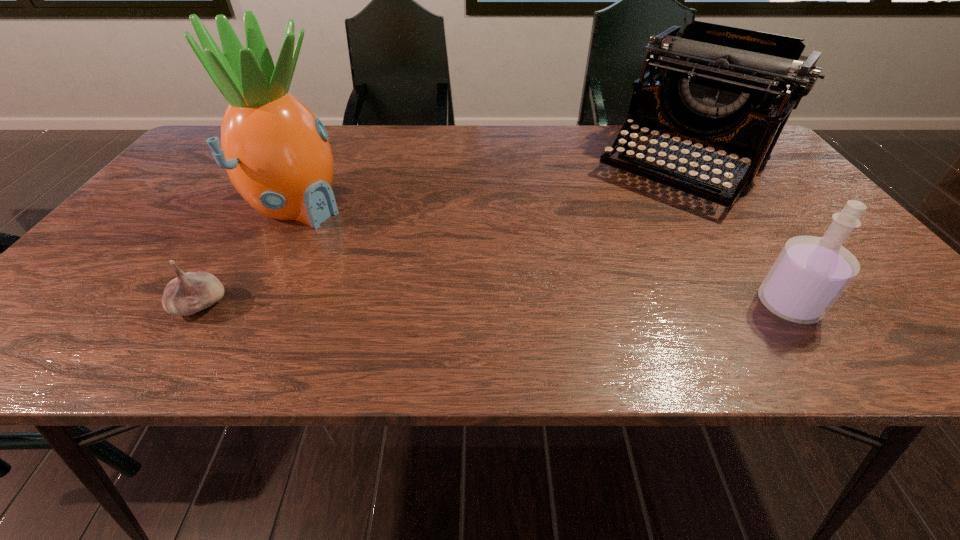
This screenshot has height=540, width=960. I want to click on vacant space located on the typing side of the typewriter, so click(x=582, y=278).

The height and width of the screenshot is (540, 960). What are the coordinates of `vacant space situated on the typing side of the typewriter` in the screenshot? It's located at (615, 242).

This screenshot has height=540, width=960. What are the coordinates of `object located in the far edge section of the desktop` in the screenshot? It's located at (730, 90).

Where is `garlic that is positioned at the near edge`? This screenshot has width=960, height=540. garlic that is positioned at the near edge is located at coordinates tap(191, 292).

Identify the location of perfume present at the near edge. (809, 275).

Locate an element on the screen. object that is at the right edge is located at coordinates (730, 90).

Locate an element on the screen. object that is positioned at the far right corner is located at coordinates (730, 90).

In the image, there is a desktop. What are the coordinates of `free space at the far edge` in the screenshot? It's located at (392, 149).

I want to click on vacant area at the near edge of the desktop, so click(x=667, y=284).

You are a GUI agent. You are given a task and a screenshot of the screen. Output one action in this format:
    pyautogui.click(x=<x>, y=<y>)
    Task: Click on the free space at the right edge of the desktop
    
    Given the screenshot: What is the action you would take?
    pyautogui.click(x=809, y=211)